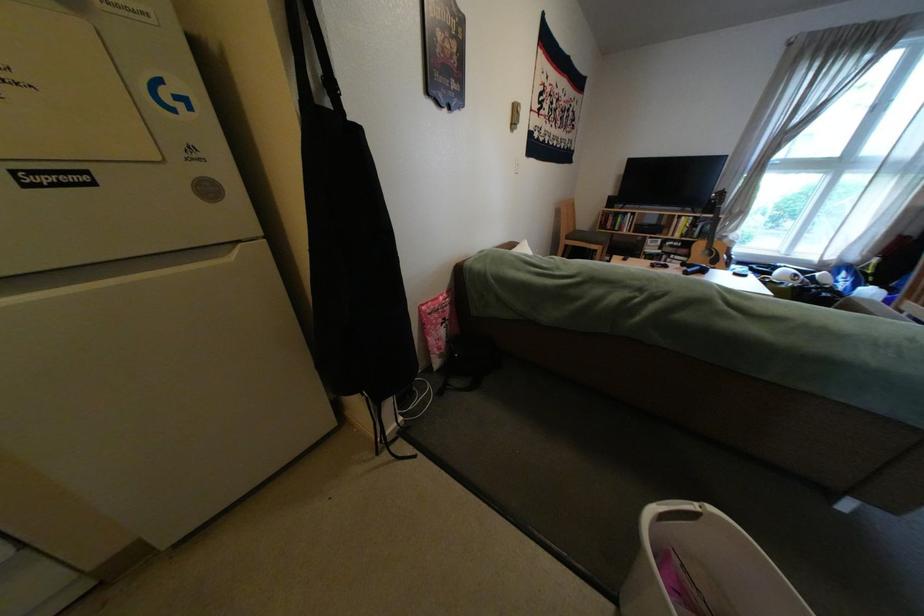
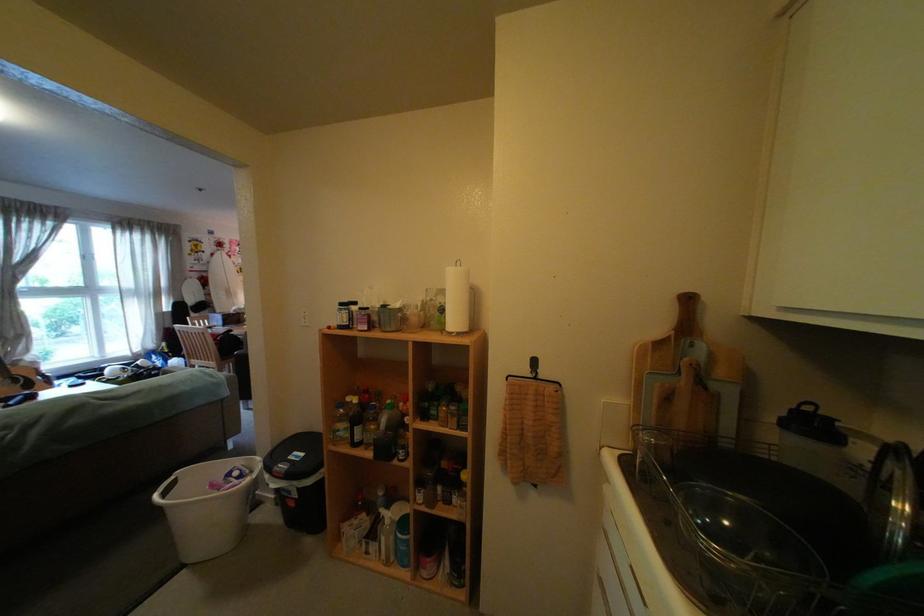
Locate, in the second image, the point that corresponds to the point at 650,299 in the first image.

(20, 437)